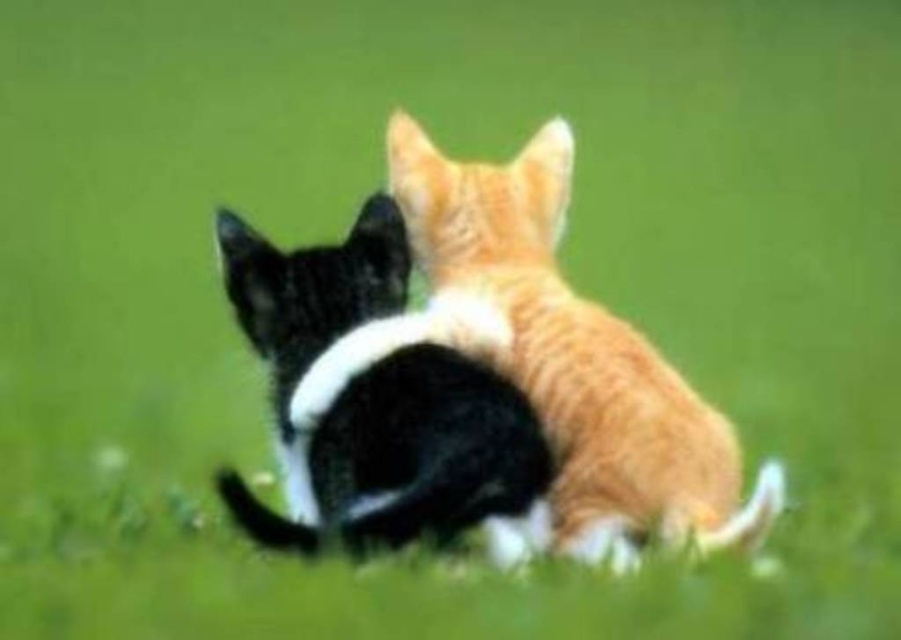
You are a photographer trying to capture a photo of both cats. Since you want to ensure they are both in the frame, which direction should you move to include both the orange fur cat at center and the black and white fur cat at center in your shot?

The orange fur cat at center is positioned on the right side of the black and white fur cat at center. To include both in the frame, you should move to the left side of the black and white fur cat at center so that both cats are within your camera view.

You are a photographer trying to capture both cats in a single frame. Since the orange fur cat at center and the black and white fur cat at center are sitting side by side, which cat would you need to position closer to the camera to ensure both fit in the frame without cropping?

The orange fur cat at center is bigger than the black and white fur cat at center, so you should position the orange fur cat at center closer to the camera to ensure both fit in the frame without cropping.